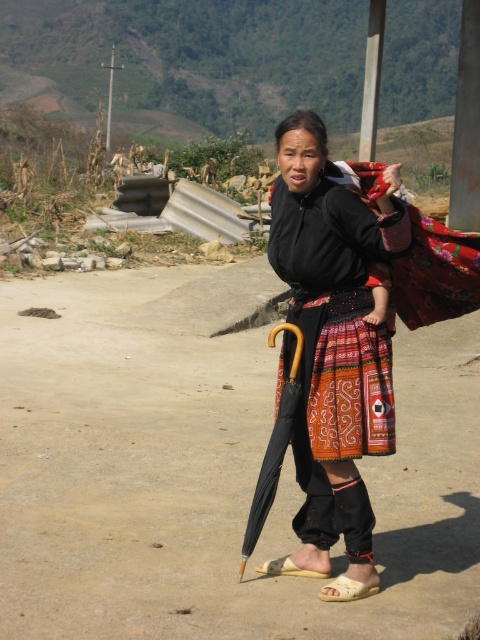
Question: Does black fabric umbrella at lower center appear on the right side of light brown leather sandal at lower center?

Choices:
 (A) yes
 (B) no

Answer: (B)

Question: Which is farther from the light brown leather sandal at lower center?

Choices:
 (A) black matte skirt at center
 (B) beige fabric sandal at lower center
 (C) black fabric umbrella at lower center

Answer: (A)

Question: Can you confirm if beige fabric sandal at lower center is positioned above light brown leather sandal at lower center?

Choices:
 (A) no
 (B) yes

Answer: (A)

Question: Which object is farther from the camera taking this photo?

Choices:
 (A) black matte skirt at center
 (B) beige fabric sandal at lower center
 (C) black fabric umbrella at lower center
 (D) light brown leather sandal at lower center

Answer: (D)

Question: Does black matte skirt at center have a lesser width compared to beige fabric sandal at lower center?

Choices:
 (A) no
 (B) yes

Answer: (A)

Question: Which object is the closest to the black matte skirt at center?

Choices:
 (A) black fabric umbrella at lower center
 (B) beige fabric sandal at lower center
 (C) light brown leather sandal at lower center

Answer: (A)